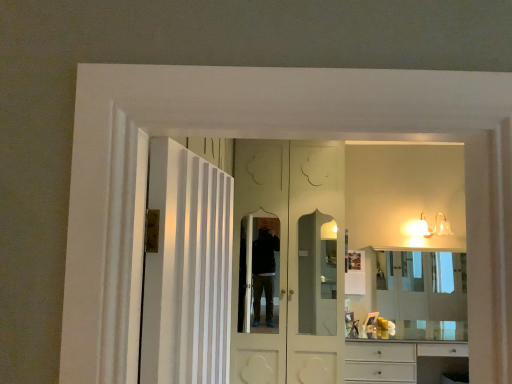
Question: Is white glossy door at center, marked as the first door in a front-to-back arrangement, in front of or behind white glossy wall sconce at upper right in the image?

Choices:
 (A) front
 (B) behind

Answer: (A)

Question: Is point (204, 319) closer or farther from the camera than point (408, 230)?

Choices:
 (A) farther
 (B) closer

Answer: (B)

Question: Estimate the real-world distances between objects in this image. Which object is farther from the white glossy door at center, which is the 2th door in front-to-back order?

Choices:
 (A) white glossy door at center, marked as the first door in a front-to-back arrangement
 (B) white glossy cabinet at lower right
 (C) white glossy wall sconce at upper right
 (D) clear glass mirror at center

Answer: (A)

Question: Which object is the farthest from the white glossy cabinet at lower right?

Choices:
 (A) clear glass mirror at center
 (B) white glossy door at center, arranged as the second door when viewed from the back
 (C) white glossy door at center, the first door when ordered from back to front
 (D) white glossy wall sconce at upper right

Answer: (B)